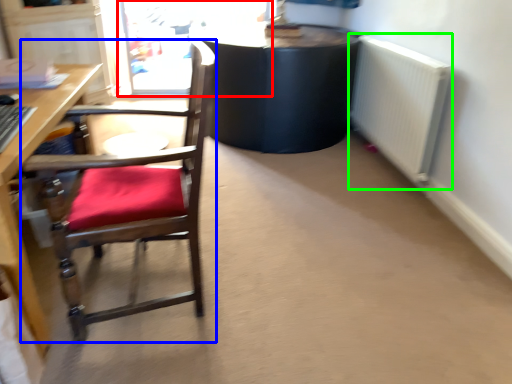
Question: Which is farther away from screen door (highlighted by a red box)? chair (highlighted by a blue box) or radiator (highlighted by a green box)?

Choices:
 (A) chair
 (B) radiator

Answer: (A)